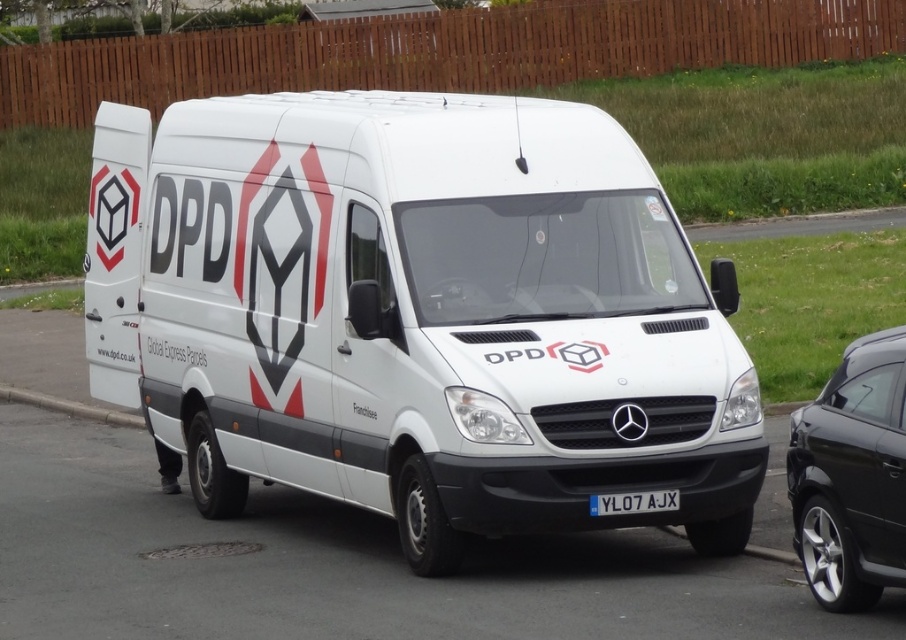
Question: Considering the relative positions of concrete at lower left and white plastic license plate at center in the image provided, where is concrete at lower left located with respect to white plastic license plate at center?

Choices:
 (A) below
 (B) above

Answer: (B)

Question: Which point is farther to the camera?

Choices:
 (A) (494, 420)
 (B) (854, 582)
 (C) (642, 499)
 (D) (44, 396)

Answer: (D)

Question: Among these points, which one is nearest to the camera?

Choices:
 (A) (660, 276)
 (B) (644, 493)
 (C) (85, 417)

Answer: (B)

Question: Which point appears farthest from the camera in this image?

Choices:
 (A) [864, 582]
 (B) [37, 404]

Answer: (B)

Question: Is concrete at lower left smaller than white plastic license plate at center?

Choices:
 (A) yes
 (B) no

Answer: (B)

Question: Is concrete at lower left bigger than white plastic license plate at center?

Choices:
 (A) no
 (B) yes

Answer: (B)